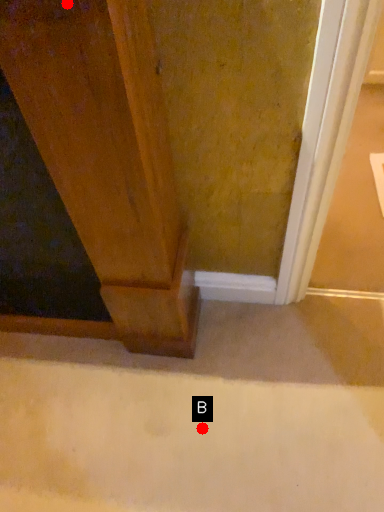
Question: Two points are circled on the image, labeled by A and B beside each circle. Which point appears closest to the camera in this image?

Choices:
 (A) A is closer
 (B) B is closer

Answer: (A)